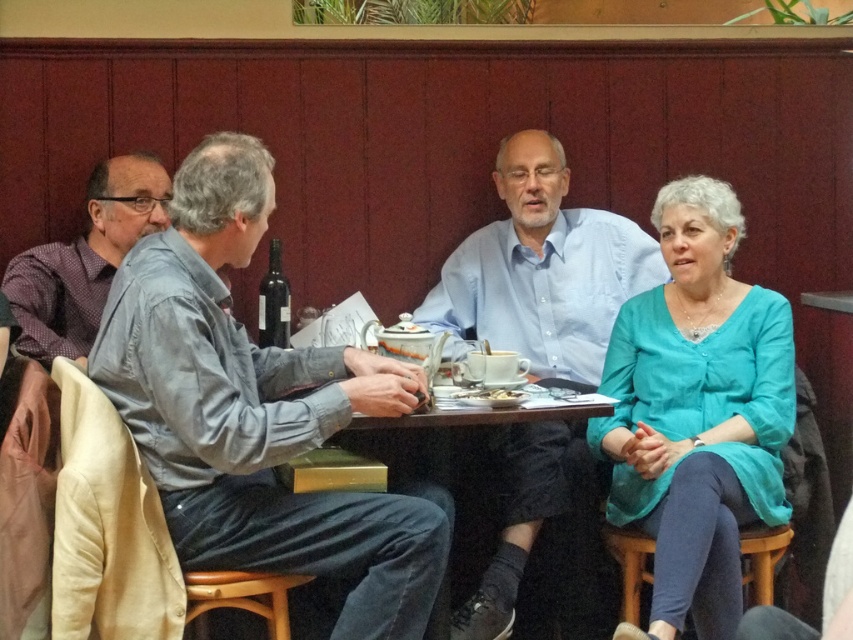
You are a server in a restaurant who needs to place a 40 cm wide tray between the teal fabric blouse at right and the wooden stool at lower right. Can you fit the tray there?

The distance between the teal fabric blouse at right and the wooden stool at lower right is 38.08 centimeters, which is less than the 40 cm width of the tray. Therefore, the tray cannot fit in that space.

Based on the photo, you are sitting at the small wooden table in the cozy cafe with the dark red paneled wall. There are two points marked in the scene. The first point is at coordinate (720, 278) and the second point is at (96, 221). If you were to look towards the green foliage at the top edge of the frame, which point would be closer to your line of sight?

Point (720, 278) is in front of point (96, 221), so when looking towards the green foliage at the top edge of the frame, the first point would be closer to your line of sight.